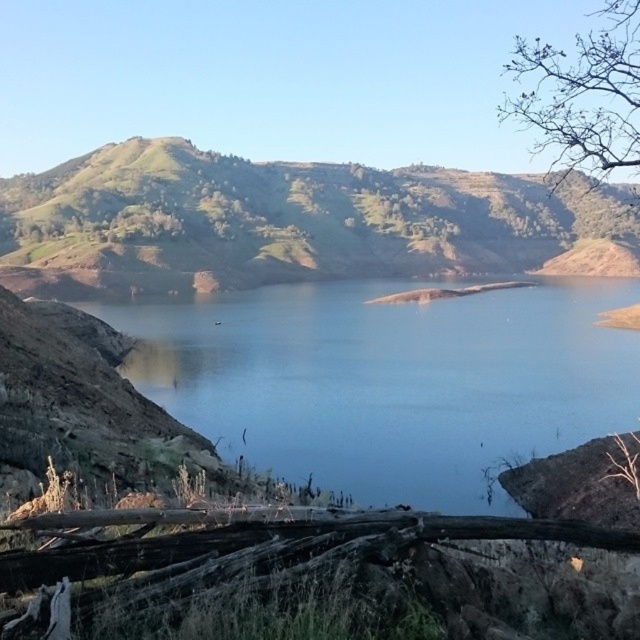
Question: From the image, what is the correct spatial relationship of green grassy hill at center in relation to bare branches at upper right?

Choices:
 (A) right
 (B) left

Answer: (B)

Question: Which point is closer to the camera?

Choices:
 (A) green grassy hill at center
 (B) blue water at center
 (C) bare branches at upper right

Answer: (C)

Question: Is blue water at center positioned behind green grassy hill at center?

Choices:
 (A) no
 (B) yes

Answer: (A)

Question: Can you confirm if blue water at center is smaller than green grassy hill at center?

Choices:
 (A) no
 (B) yes

Answer: (B)

Question: Among these objects, which one is nearest to the camera?

Choices:
 (A) green grassy hill at center
 (B) blue water at center
 (C) bare branches at upper right

Answer: (C)

Question: Which is farther from the blue water at center?

Choices:
 (A) bare branches at upper right
 (B) green grassy hill at center

Answer: (A)